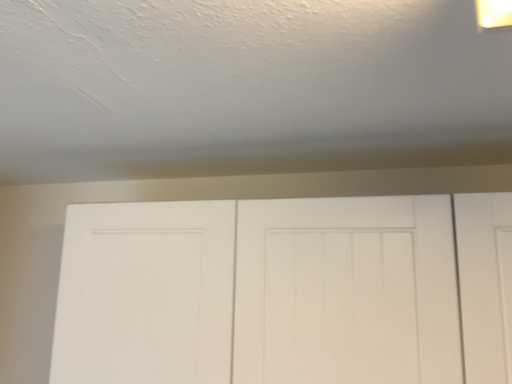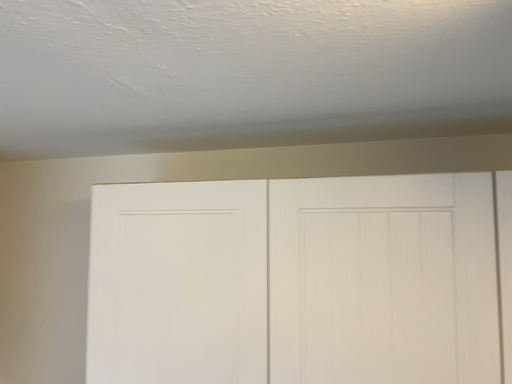
Question: How did the camera likely rotate when shooting the video?

Choices:
 (A) rotated downward
 (B) rotated upward

Answer: (A)